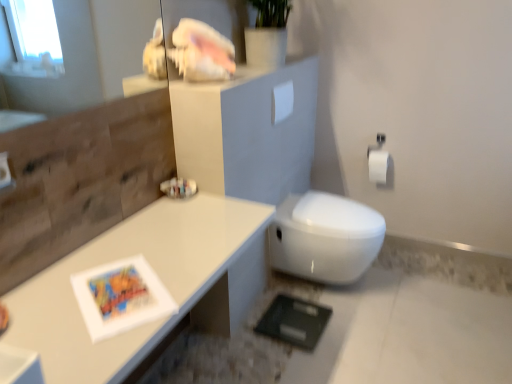
Question: Is there a large distance between white glossy table at upper left and white matte toilet paper at right, which is the 1th toilet paper in right-to-left order?

Choices:
 (A) yes
 (B) no

Answer: (A)

Question: Does white glossy table at upper left have a lesser height compared to white matte toilet paper at right, the first toilet paper when ordered from bottom to top?

Choices:
 (A) yes
 (B) no

Answer: (B)

Question: Is white glossy table at upper left looking in the opposite direction of white matte toilet paper at right, the second toilet paper in the front-to-back sequence?

Choices:
 (A) no
 (B) yes

Answer: (A)

Question: Is white glossy table at upper left further to the viewer compared to white matte toilet paper at right, which is the 1th toilet paper in right-to-left order?

Choices:
 (A) yes
 (B) no

Answer: (B)

Question: Can you confirm if white glossy table at upper left is positioned to the left of white matte toilet paper at right, the first toilet paper when ordered from bottom to top?

Choices:
 (A) yes
 (B) no

Answer: (A)

Question: From the image's perspective, is white glossy table at upper left beneath white matte toilet paper at right, arranged as the 1th toilet paper when viewed from the back?

Choices:
 (A) yes
 (B) no

Answer: (A)

Question: Is white glossy shell at upper center in front of white matte toilet paper at upper center, the 1th toilet paper when ordered from front to back?

Choices:
 (A) yes
 (B) no

Answer: (A)

Question: Considering the relative sizes of white glossy shell at upper center and white matte toilet paper at upper center, which is the 2th toilet paper in back-to-front order, in the image provided, is white glossy shell at upper center shorter than white matte toilet paper at upper center, which is the 2th toilet paper in back-to-front order,?

Choices:
 (A) yes
 (B) no

Answer: (A)

Question: Are white glossy shell at upper center and white matte toilet paper at upper center, the second toilet paper viewed from the right, far apart?

Choices:
 (A) no
 (B) yes

Answer: (A)

Question: From a real-world perspective, is white glossy shell at upper center physically below white matte toilet paper at upper center, the second toilet paper viewed from the right?

Choices:
 (A) no
 (B) yes

Answer: (A)

Question: From a real-world perspective, is white glossy shell at upper center over white matte toilet paper at upper center, the first toilet paper viewed from the left?

Choices:
 (A) yes
 (B) no

Answer: (A)

Question: Can you confirm if white glossy shell at upper center is thinner than white matte toilet paper at upper center, the 1th toilet paper when ordered from front to back?

Choices:
 (A) yes
 (B) no

Answer: (B)

Question: Is white matte toilet paper at upper center, the second toilet paper viewed from the right, to the right of white matte toilet paper at right, the second toilet paper in the left-to-right sequence, from the viewer's perspective?

Choices:
 (A) yes
 (B) no

Answer: (B)